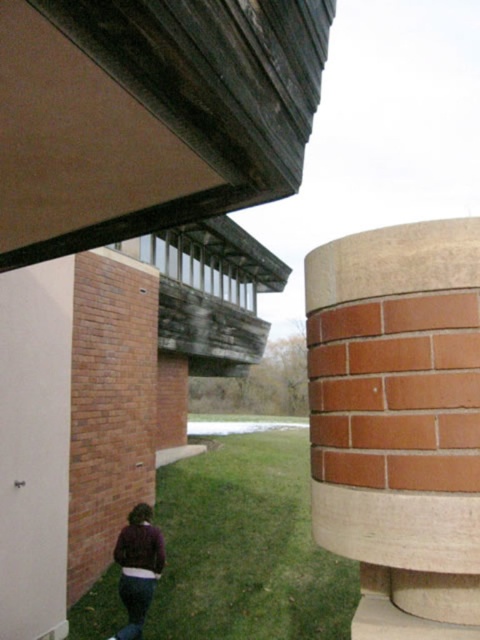
You are an architect reviewing a 3D model of a modern building. You notice two points in the design labeled as point [336,508] and point [146,563]. If you were to walk towards the building from the front, which point would appear closer to you in the 3D model?

Point [336,508] is closer to the camera than point [146,563], so when walking towards the building from the front, point [336,508] would appear closer to you in the 3D model.

You are an architect reviewing a 3D model of a modern building. You notice two points marked in the scene. The first point is at coordinate point (340, 445) and the second is at point (132, 605). Based on the perspective in the image, which of these points is closer to your viewpoint as the architect?

Point (340, 445) is closer to the camera than point (132, 605), so the first point is closer to your viewpoint.

You are standing at the center of the image and want to walk towards the two points marked as point (132, 609) and point (139, 564). Which point will you reach first?

Point (132, 609) is in front of point (139, 564), so you will reach point (132, 609) first.